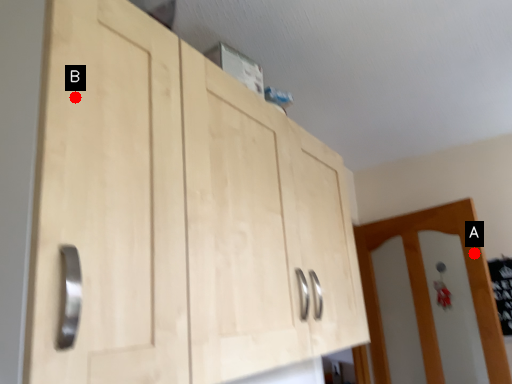
Question: Two points are circled on the image, labeled by A and B beside each circle. Among these points, which one is nearest to the camera?

Choices:
 (A) A is closer
 (B) B is closer

Answer: (B)